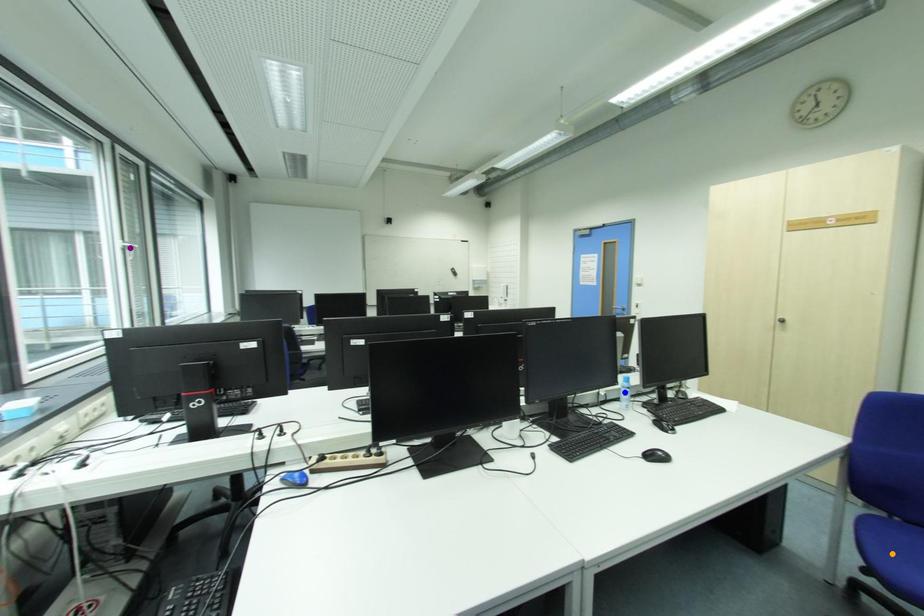
Order these from nearest to farthest:
orange point, purple point, blue point

purple point, blue point, orange point